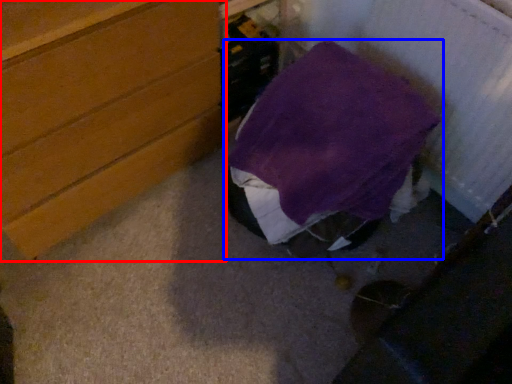
Question: Which point is further to the camera, chest of drawers (highlighted by a red box) or furniture (highlighted by a blue box)?

Choices:
 (A) chest of drawers
 (B) furniture

Answer: (B)